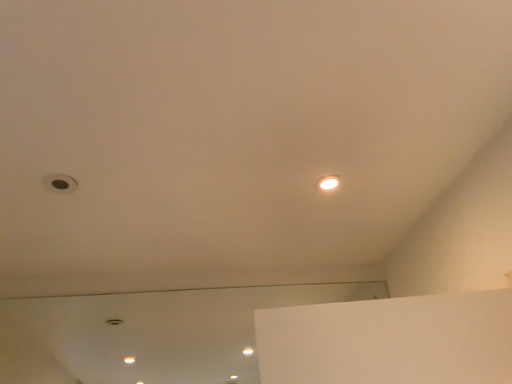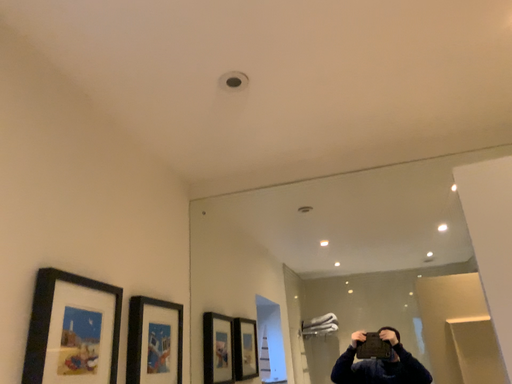
Question: Which way did the camera rotate in the video?

Choices:
 (A) rotated left
 (B) rotated right

Answer: (A)